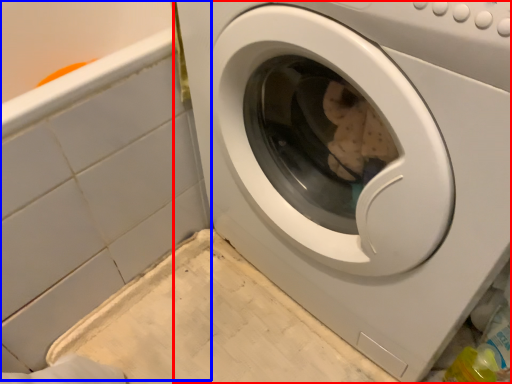
Question: Which point is closer to the camera, washing machine (highlighted by a red box) or bath (highlighted by a blue box)?

Choices:
 (A) washing machine
 (B) bath

Answer: (A)